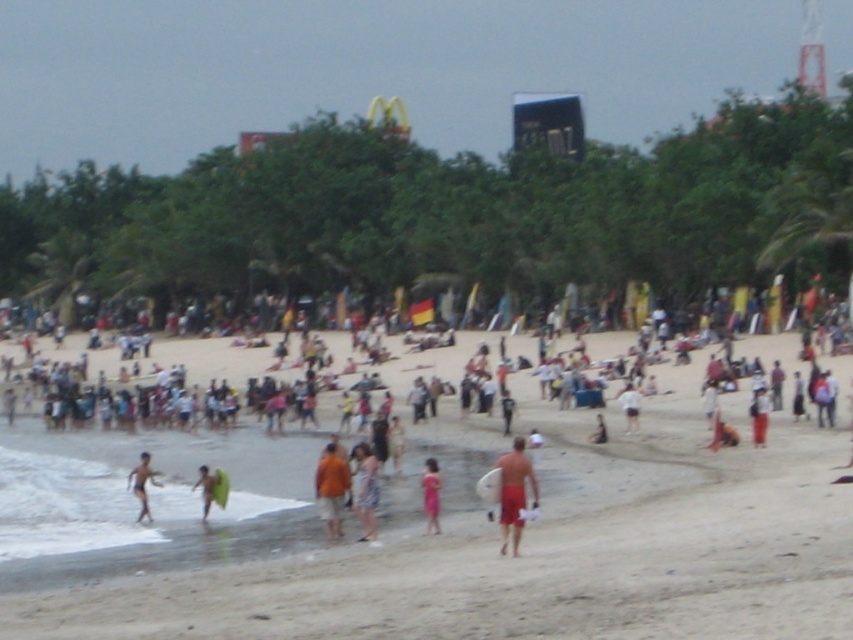
Can you confirm if orange fabric shirt at center is positioned to the right of pink fabric dress at center?

In fact, orange fabric shirt at center is to the left of pink fabric dress at center.

Does orange fabric shirt at center have a greater width compared to pink fabric dress at center?

Yes, orange fabric shirt at center is wider than pink fabric dress at center.

Is point (331, 449) closer to viewer compared to point (422, 490)?

Yes, point (331, 449) is in front of point (422, 490).

Locate an element on the screen. orange fabric shirt at center is located at coordinates (332, 486).

Between beige sand at center and smooth tan skin at center, which one appears on the right side from the viewer's perspective?

beige sand at center

Is point (691, 464) farther from viewer compared to point (209, 490)?

Yes, it is.

Is point (115, 589) positioned before point (212, 500)?

Yes, it is in front of point (212, 500).

Identify the location of beige sand at center. (521, 545).

From the picture: Which is more to the left, beige sand at center or light blue denim shorts at center?

beige sand at center is more to the left.

What do you see at coordinates (521, 545) in the screenshot? Image resolution: width=853 pixels, height=640 pixels. I see `beige sand at center` at bounding box center [521, 545].

The image size is (853, 640). I want to click on beige sand at center, so point(521,545).